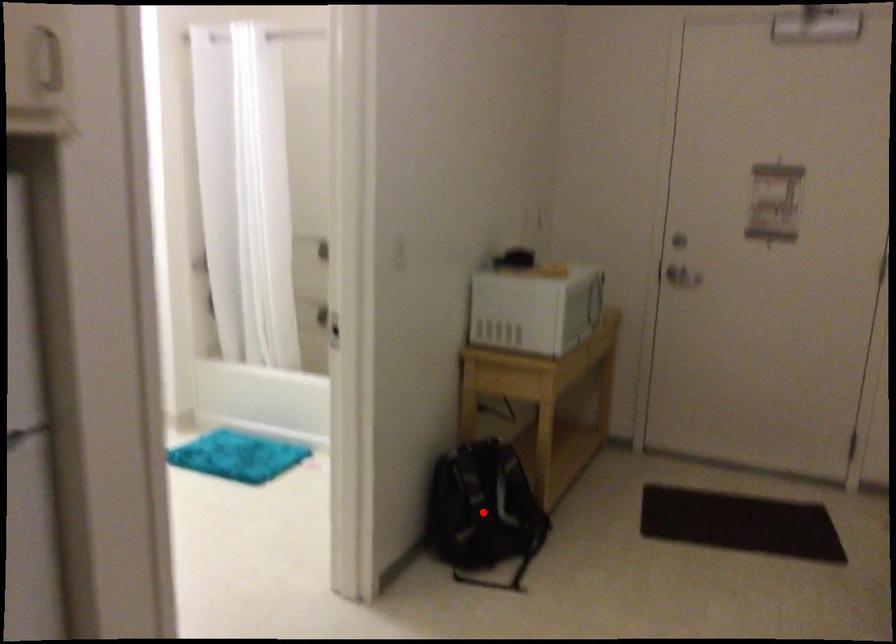
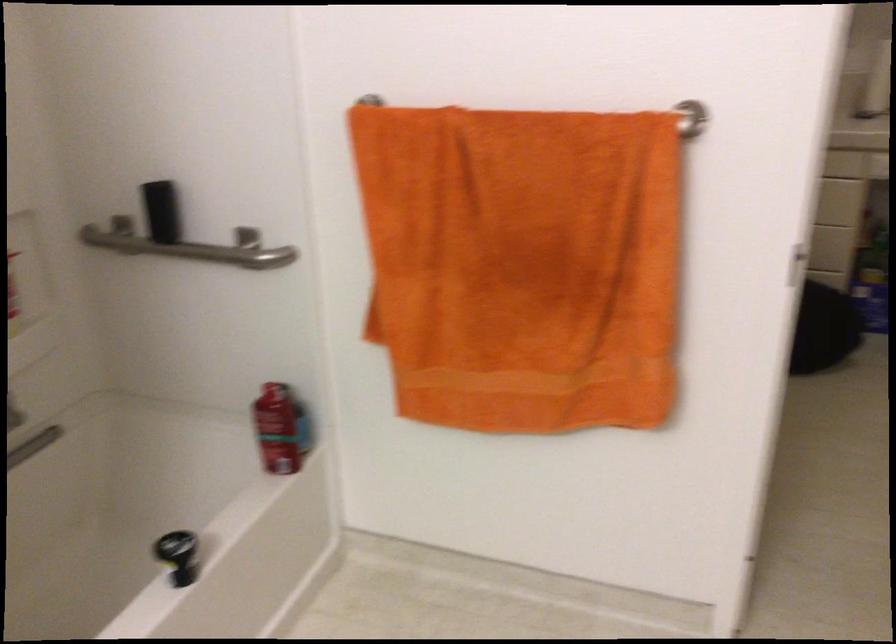
Question: I am providing you with two images of the same scene from different viewpoints. A red point is marked on the first image. Can you still see the location of the red point in image 2?

Choices:
 (A) Yes
 (B) No

Answer: (B)